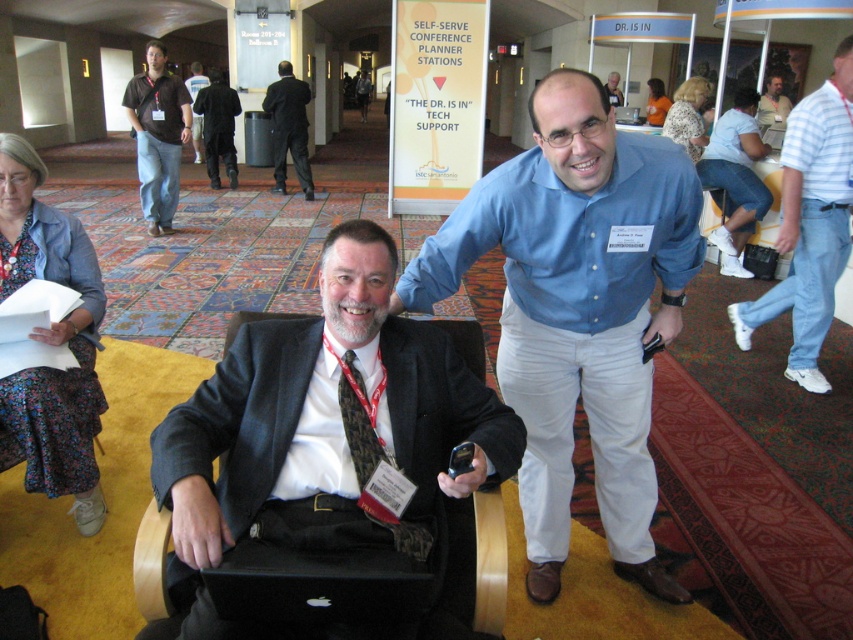
You are attending an event and need to locate two attendees wearing a white cotton shirt at upper right and a dark blue shirt at center. Based on their positions, which one is positioned to the east side of the other?

The white cotton shirt at upper right is to the right of dark blue shirt at center, so the white cotton shirt at upper right is positioned to the east side of the dark blue shirt at center.

You are organizing a photo shoot and need to ensure all participants are visible in the frame. Given that the dark blue shirt at center and the orange shirt at upper center are in the shot, which one might require more space to fully capture in the photo?

The orange shirt at upper center requires more space because its width is greater than the dark blue shirt at center.